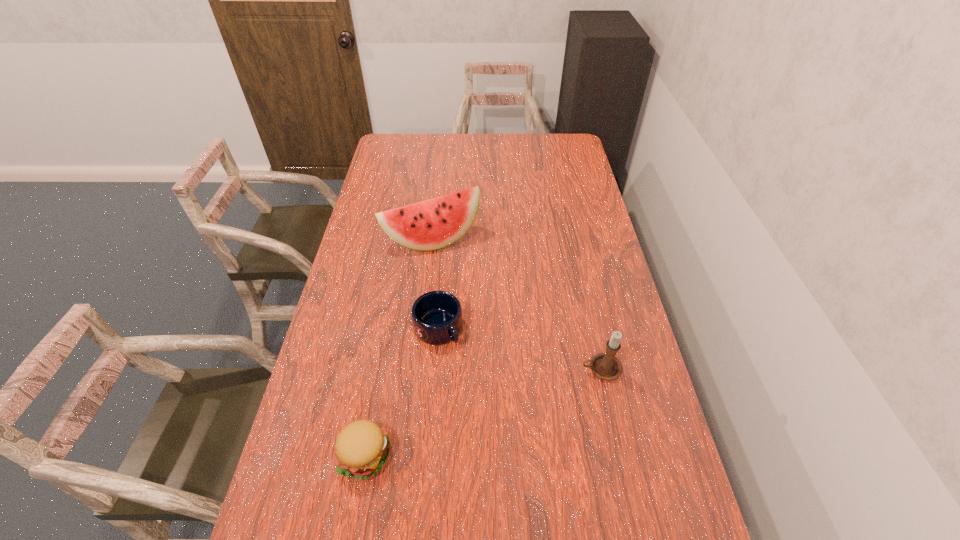
Find the location of `vacant space located on the outer rind of the tallest object`. vacant space located on the outer rind of the tallest object is located at coordinates (492, 325).

Locate an element on the screen. The image size is (960, 540). free region located 0.250m on the outer rind of the tallest object is located at coordinates (478, 302).

This screenshot has width=960, height=540. Find the location of `vacant space located 0.330m on the outer rind of the tallest object`. vacant space located 0.330m on the outer rind of the tallest object is located at coordinates (489, 321).

Identify the location of vacant space situated 0.080m with the handle on the side of the mug. (468, 364).

Locate an element on the screen. Image resolution: width=960 pixels, height=540 pixels. vacant area situated 0.390m with the handle on the side of the mug is located at coordinates (542, 450).

This screenshot has height=540, width=960. Find the location of `vacant area situated with the handle on the side of the mug`. vacant area situated with the handle on the side of the mug is located at coordinates (462, 357).

What are the coordinates of `hamburger situated at the left edge` in the screenshot? It's located at (361, 448).

Image resolution: width=960 pixels, height=540 pixels. In order to click on watermelon that is at the left edge in this screenshot , I will do `click(435, 223)`.

You are a GUI agent. You are given a task and a screenshot of the screen. Output one action in this format:
    pyautogui.click(x=<x>, y=<y>)
    Task: Click on the object that is at the right edge
    
    Given the screenshot: What is the action you would take?
    pyautogui.click(x=606, y=366)

This screenshot has height=540, width=960. Identify the location of free location at the far edge of the desktop. pos(541,141).